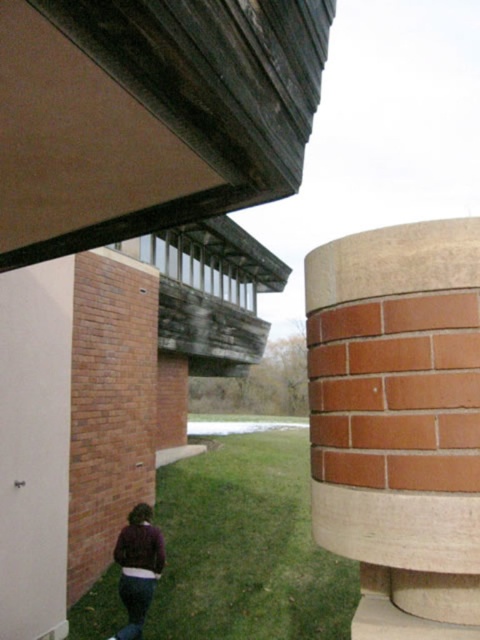
Question: Estimate the real-world distances between objects in this image. Which object is closer to the purple sweater at lower left?

Choices:
 (A) purple fleece sweatshirt at lower center
 (B) red brick column at center right
 (C) green grass at lower center

Answer: (A)

Question: Which object is farther from the camera taking this photo?

Choices:
 (A) purple sweater at lower left
 (B) green grass at lower center

Answer: (B)

Question: Does red brick column at center right have a greater width compared to green grass at lower center?

Choices:
 (A) no
 (B) yes

Answer: (A)

Question: Which point is closer to the camera taking this photo?

Choices:
 (A) (141, 557)
 (B) (400, 278)

Answer: (B)

Question: Does green grass at lower center have a lesser width compared to purple sweater at lower left?

Choices:
 (A) yes
 (B) no

Answer: (B)

Question: Does red brick column at center right have a lesser width compared to purple sweater at lower left?

Choices:
 (A) no
 (B) yes

Answer: (B)